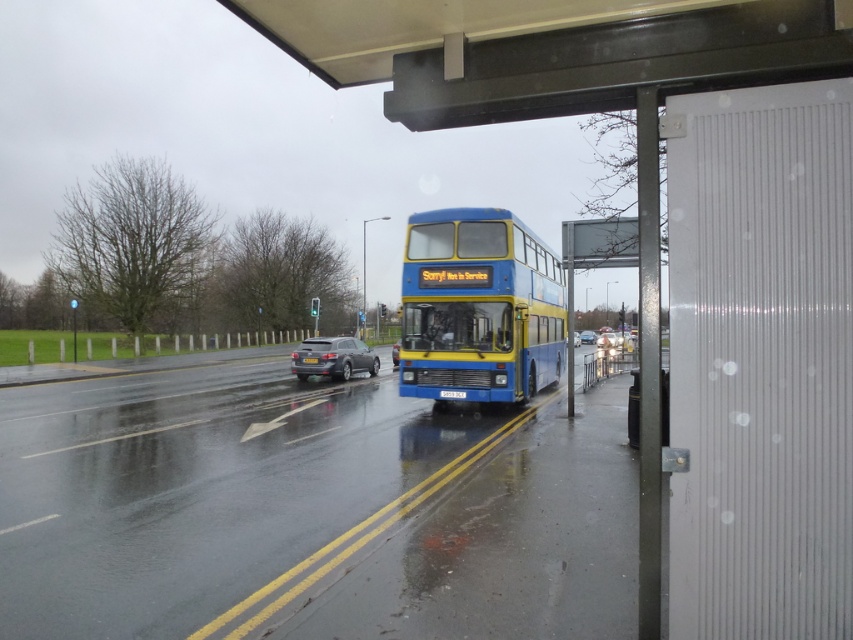
Between blue/yellow painted double-decker bus at center and metallic silver car at center, which one appears on the right side from the viewer's perspective?

metallic silver car at center is more to the right.

Does point (416, 253) come behind point (579, 337)?

No, (416, 253) is closer to viewer.

I want to click on blue/yellow painted double-decker bus at center, so click(x=479, y=307).

Image resolution: width=853 pixels, height=640 pixels. What are the coordinates of `blue/yellow painted double-decker bus at center` in the screenshot? It's located at (479, 307).

Who is more distant from viewer, (343,371) or (583,333)?

Positioned behind is point (583,333).

Is satin black sedan at center positioned before metallic silver car at center?

Yes, satin black sedan at center is closer to the viewer.

The height and width of the screenshot is (640, 853). I want to click on satin black sedan at center, so click(334, 356).

Does blue/yellow painted double-decker bus at center appear on the left side of blue metallic license plate at center?

No, blue/yellow painted double-decker bus at center is not to the left of blue metallic license plate at center.

Image resolution: width=853 pixels, height=640 pixels. I want to click on blue/yellow painted double-decker bus at center, so click(479, 307).

Image resolution: width=853 pixels, height=640 pixels. What are the coordinates of `blue/yellow painted double-decker bus at center` in the screenshot? It's located at (479, 307).